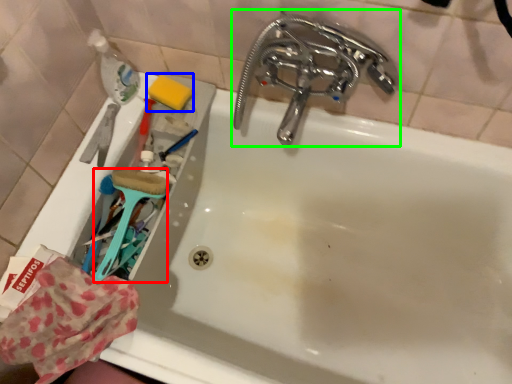
Question: Which is farther away from brush (highlighted by a red box)? soap (highlighted by a blue box) or tap (highlighted by a green box)?

Choices:
 (A) soap
 (B) tap

Answer: (B)